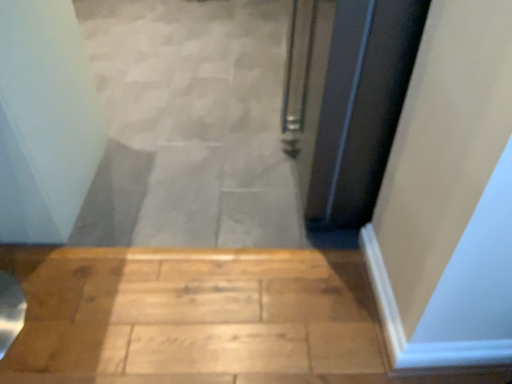
Question: Considering the positions of smooth concrete stairs at center and black glossy door at upper right in the image, is smooth concrete stairs at center wider or thinner than black glossy door at upper right?

Choices:
 (A) wide
 (B) thin

Answer: (A)

Question: Considering the positions of smooth concrete stairs at center and black glossy door at upper right in the image, is smooth concrete stairs at center taller or shorter than black glossy door at upper right?

Choices:
 (A) tall
 (B) short

Answer: (B)

Question: Relative to black glossy door at upper right, is smooth concrete stairs at center in front or behind?

Choices:
 (A) front
 (B) behind

Answer: (B)

Question: Looking at the image, does black glossy door at upper right seem bigger or smaller compared to smooth concrete stairs at center?

Choices:
 (A) small
 (B) big

Answer: (B)

Question: Is black glossy door at upper right spatially inside smooth concrete stairs at center, or outside of it?

Choices:
 (A) inside
 (B) outside

Answer: (B)

Question: Considering their positions, is black glossy door at upper right located in front of or behind smooth concrete stairs at center?

Choices:
 (A) behind
 (B) front

Answer: (B)

Question: Does point (351, 182) appear closer or farther from the camera than point (211, 79)?

Choices:
 (A) farther
 (B) closer

Answer: (B)